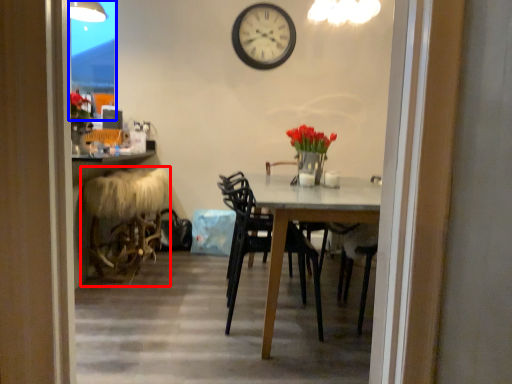
Question: Which point is further to the camera, folding chair (highlighted by a red box) or glass door (highlighted by a blue box)?

Choices:
 (A) folding chair
 (B) glass door

Answer: (B)